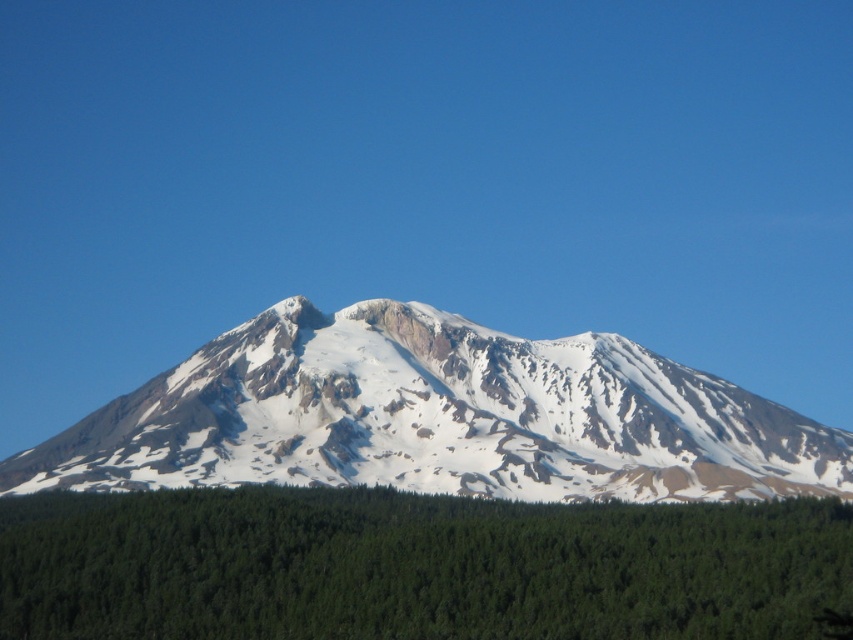
Question: Which point is closer to the camera?

Choices:
 (A) (416, 394)
 (B) (6, 548)

Answer: (B)

Question: Which point appears closest to the camera in this image?

Choices:
 (A) (838, 584)
 (B) (247, 403)

Answer: (A)

Question: Does green matte tree at lower center have a larger size compared to white snow-covered mountain at center?

Choices:
 (A) no
 (B) yes

Answer: (A)

Question: Which object appears closest to the camera in this image?

Choices:
 (A) white snow-covered mountain at center
 (B) green matte tree at lower center

Answer: (B)

Question: Does green matte tree at lower center appear on the left side of white snow-covered mountain at center?

Choices:
 (A) yes
 (B) no

Answer: (A)

Question: Is green matte tree at lower center wider than white snow-covered mountain at center?

Choices:
 (A) yes
 (B) no

Answer: (B)